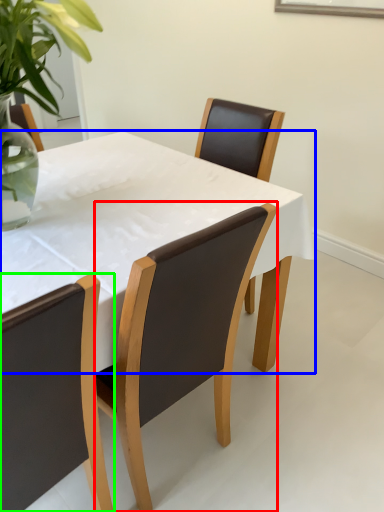
Question: Which object is the closest to the chair (highlighted by a red box)? Choose among these: kitchen & dining room table (highlighted by a blue box) or chair (highlighted by a green box).

Choices:
 (A) kitchen & dining room table
 (B) chair

Answer: (B)